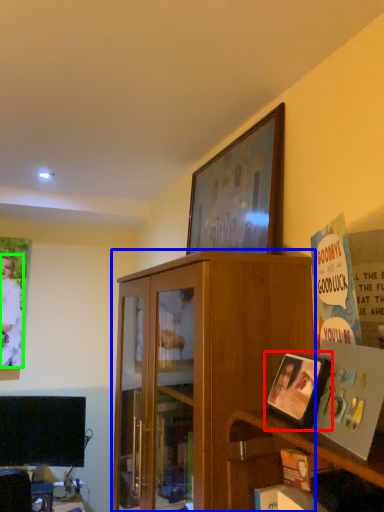
Question: Which is nearer to the picture frame (highlighted by a red box)? cabinetry (highlighted by a blue box) or person (highlighted by a green box).

Choices:
 (A) cabinetry
 (B) person

Answer: (A)